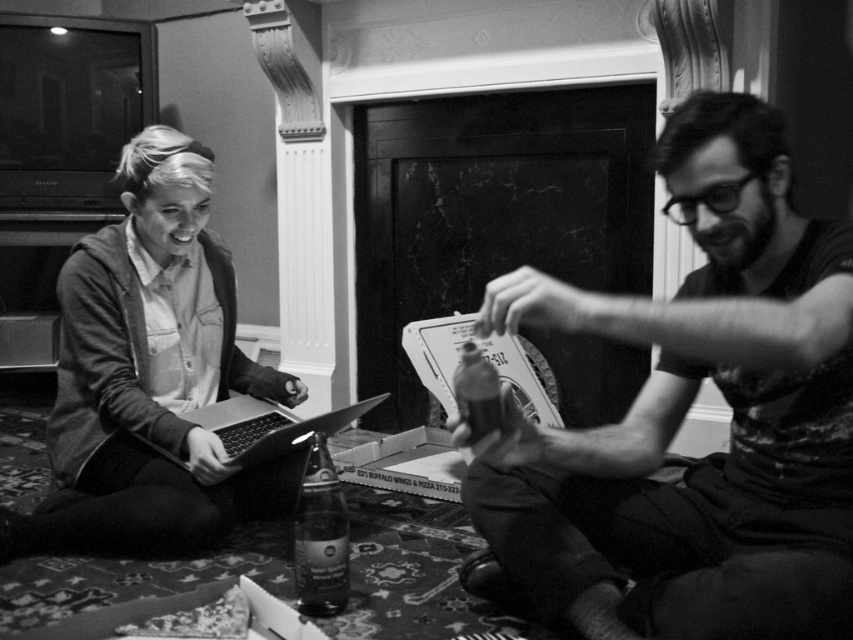
Is the position of denim jacket at left more distant than that of metallic silver laptop at center?

Yes, it is behind metallic silver laptop at center.

Is point (154, 529) more distant than point (252, 426)?

No, (154, 529) is in front of (252, 426).

Where is `denim jacket at left`? This screenshot has height=640, width=853. denim jacket at left is located at coordinates (148, 374).

Does matte black shirt at center appear on the right side of clear glass bottle at center?

Yes, matte black shirt at center is to the right of clear glass bottle at center.

Is matte black shirt at center wider than clear glass bottle at center?

Correct, the width of matte black shirt at center exceeds that of clear glass bottle at center.

Does point (840, 243) come in front of point (339, 582)?

Yes, point (840, 243) is closer to viewer.

Image resolution: width=853 pixels, height=640 pixels. I want to click on matte black shirt at center, so click(685, 413).

Between denim jacket at left and clear glass bottle at center, which one appears on the right side from the viewer's perspective?

clear glass bottle at center

Can you confirm if denim jacket at left is thinner than clear glass bottle at center?

In fact, denim jacket at left might be wider than clear glass bottle at center.

Between point (280, 392) and point (329, 513), which one is positioned in front?

Point (329, 513)

In order to click on denim jacket at left in this screenshot , I will do `click(148, 374)`.